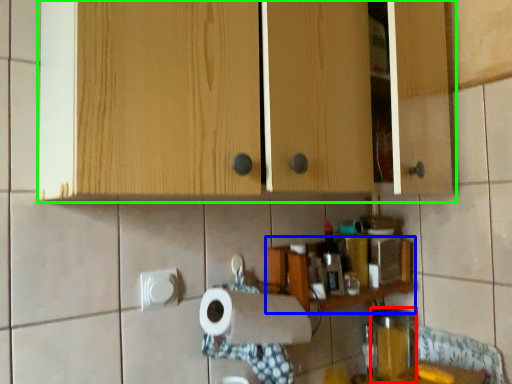
Question: Which object is the closest to the appliance (highlighted by a red box)? Choose among these: shelf (highlighted by a blue box) or cabinetry (highlighted by a green box).

Choices:
 (A) shelf
 (B) cabinetry

Answer: (A)